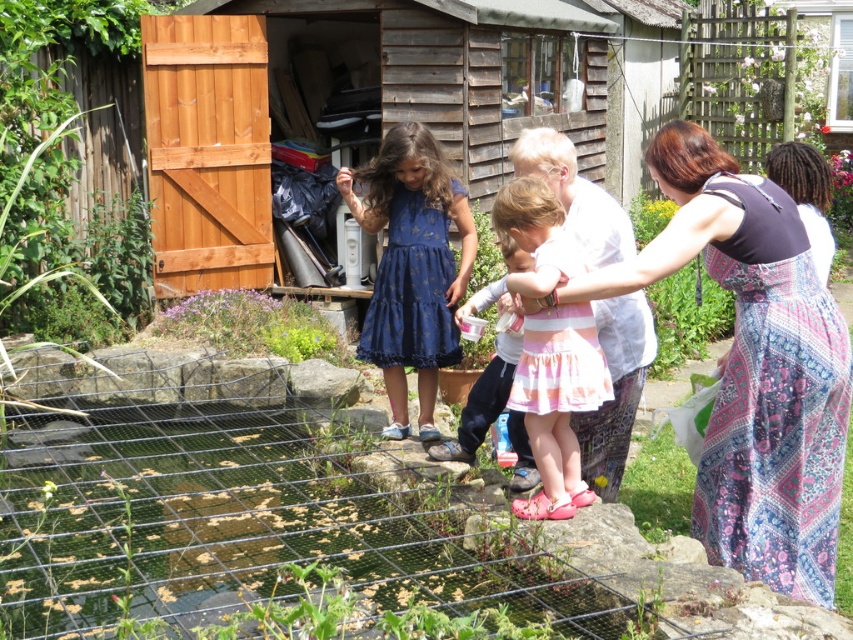
Does wooden shed at upper center have a lesser width compared to pink satin dress at center?

Yes, wooden shed at upper center is thinner than pink satin dress at center.

Can you confirm if wooden shed at upper center is positioned to the right of pink satin dress at center?

Yes, wooden shed at upper center is to the right of pink satin dress at center.

What do you see at coordinates (369, 100) in the screenshot? I see `wooden shed at upper center` at bounding box center [369, 100].

This screenshot has width=853, height=640. I want to click on wooden shed at upper center, so click(x=369, y=100).

Can you confirm if wooden shed at upper center is positioned to the left of printed cotton dress at center?

In fact, wooden shed at upper center is to the right of printed cotton dress at center.

Looking at this image, is wooden shed at upper center thinner than printed cotton dress at center?

Yes.

Is point (524, 38) positioned in front of point (717, 417)?

No, it is not.

This screenshot has height=640, width=853. I want to click on wooden shed at upper center, so click(369, 100).

Find the location of a particular element. The height and width of the screenshot is (640, 853). printed cotton dress at center is located at coordinates (752, 365).

Measure the distance between point (793, 381) and camera.

The distance of point (793, 381) from camera is 3.88 meters.

Is point (770, 513) behind point (392, 387)?

That is False.

In order to click on printed cotton dress at center in this screenshot , I will do `click(752, 365)`.